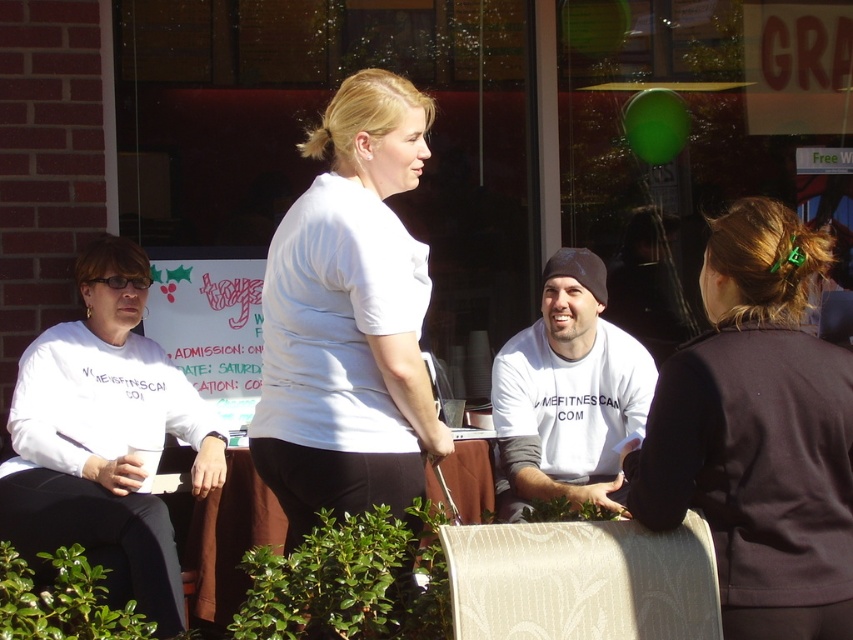
Question: Can you confirm if beige fabric chair at lower center is positioned above brown fabric table at center?

Choices:
 (A) no
 (B) yes

Answer: (B)

Question: Does white matte shirt at center appear on the right side of white matte shirt at left?

Choices:
 (A) yes
 (B) no

Answer: (A)

Question: Which point is farther from the camera taking this photo?

Choices:
 (A) (767, 212)
 (B) (451, 612)
 (C) (74, 520)
 (D) (496, 477)

Answer: (D)

Question: Estimate the real-world distances between objects in this image. Which object is farther from the dark gray fabric jacket at center?

Choices:
 (A) brown fabric table at center
 (B) white matte shirt at center
 (C) white matte t-shirt at center

Answer: (A)

Question: Is white matte t-shirt at center to the left of brown fabric table at center from the viewer's perspective?

Choices:
 (A) no
 (B) yes

Answer: (A)

Question: Which point is farther to the camera?

Choices:
 (A) (817, 273)
 (B) (460, 596)

Answer: (A)